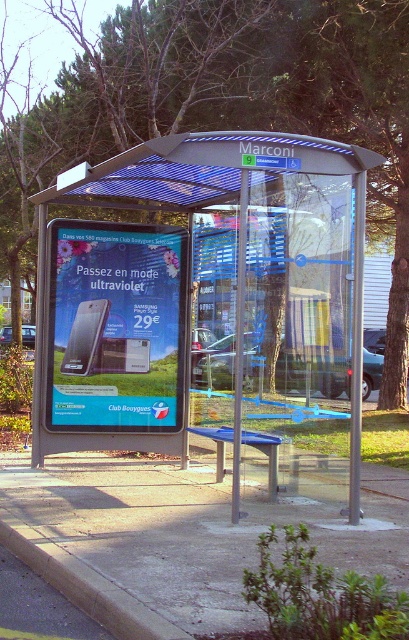
Question: Which object is closer to the camera taking this photo?

Choices:
 (A) concrete at center
 (B) transparent plastic canopy at center
 (C) yellow painted concrete curb at lower left
 (D) transparent glass bus stop at center

Answer: (C)

Question: Is transparent plastic canopy at center closer to camera compared to yellow painted concrete curb at lower left?

Choices:
 (A) yes
 (B) no

Answer: (B)

Question: Is transparent glass bus stop at center bigger than transparent plastic canopy at center?

Choices:
 (A) yes
 (B) no

Answer: (A)

Question: Which of the following is the closest to the observer?

Choices:
 (A) matte black phone at center
 (B) transparent glass bus stop at center
 (C) yellow painted concrete curb at lower left
 (D) concrete at center

Answer: (C)

Question: Does concrete at center have a smaller size compared to matte black phone at center?

Choices:
 (A) no
 (B) yes

Answer: (B)

Question: Which point is closer to the camera taking this photo?

Choices:
 (A) (137, 342)
 (B) (227, 620)

Answer: (B)